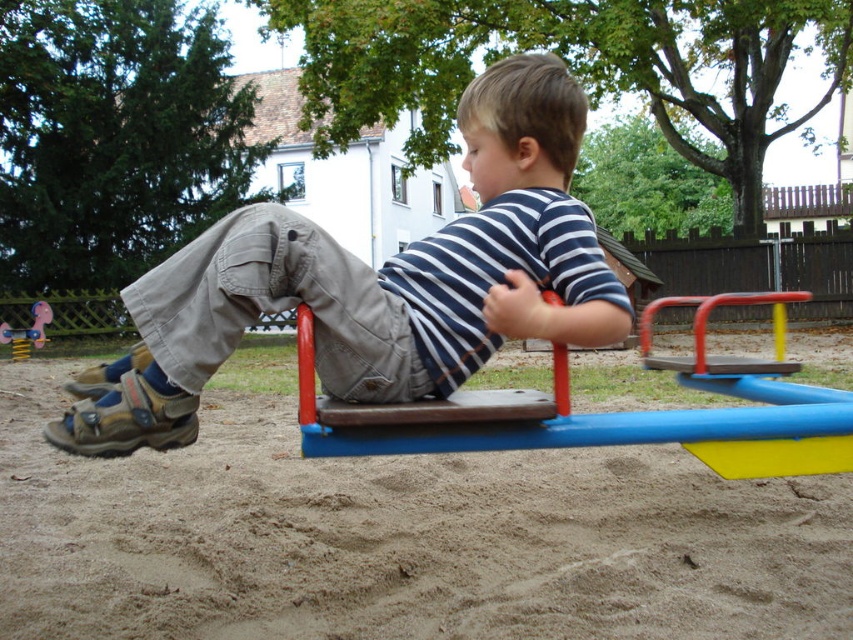
Can you confirm if brown sandy ground at center is thinner than matte khaki pants at center?

In fact, brown sandy ground at center might be wider than matte khaki pants at center.

Between brown sandy ground at center and matte khaki pants at center, which one is positioned higher?

matte khaki pants at center

Does point (668, 454) come farther from viewer compared to point (451, 248)?

Yes, point (668, 454) is farther from viewer.

At what (x,y) coordinates should I click in order to perform the action: click on brown sandy ground at center. Please return your answer as a coordinate pair (x, y). The width and height of the screenshot is (853, 640). Looking at the image, I should click on (399, 538).

Who is positioned more to the right, matte khaki pants at center or brown leather bench at center?

From the viewer's perspective, brown leather bench at center appears more on the right side.

Is point (222, 300) closer to camera compared to point (706, 317)?

That is True.

Between point (553, 339) and point (735, 472), which one is positioned in front?

Positioned in front is point (553, 339).

Identify the location of matte khaki pants at center. (376, 282).

Who is more forward, (x=759, y=397) or (x=16, y=352)?

Point (x=759, y=397)

The image size is (853, 640). I want to click on brown leather bench at center, so click(x=618, y=412).